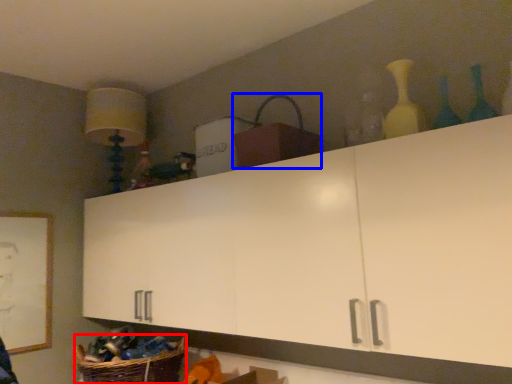
Question: Which object is closer to the camera taking this photo, basket (highlighted by a red box) or basket (highlighted by a blue box)?

Choices:
 (A) basket
 (B) basket

Answer: (B)